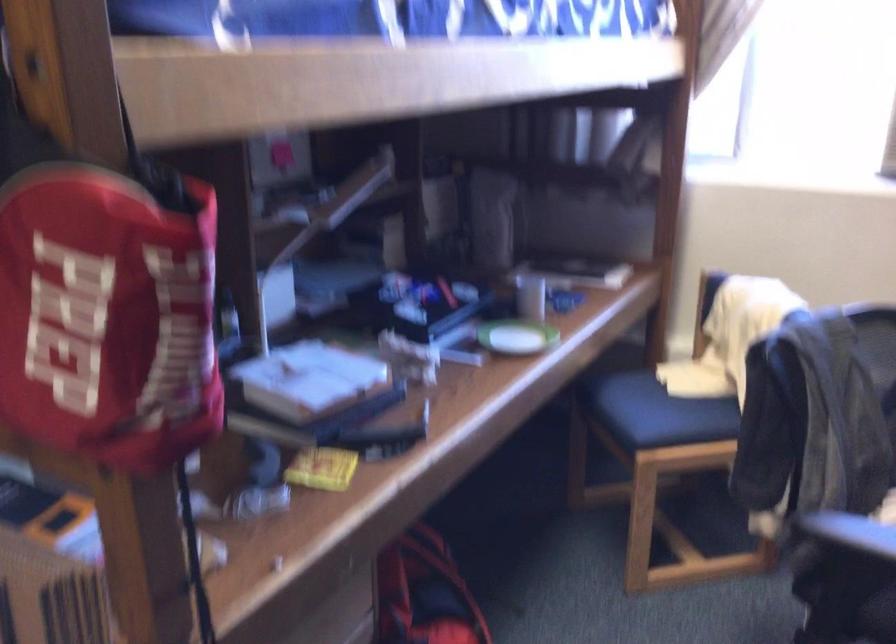
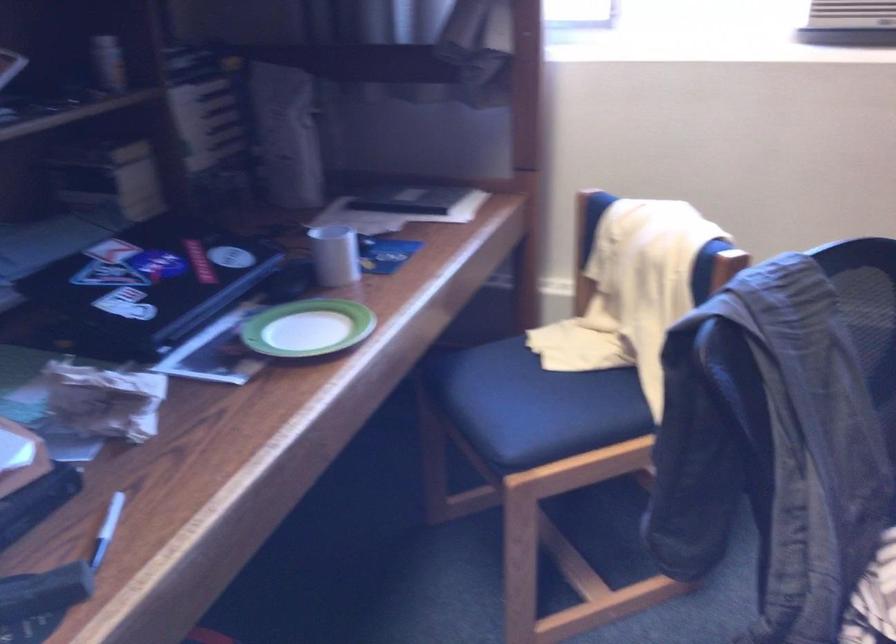
Find the pixel in the second image that matches the point at 509,341 in the first image.

(307, 328)